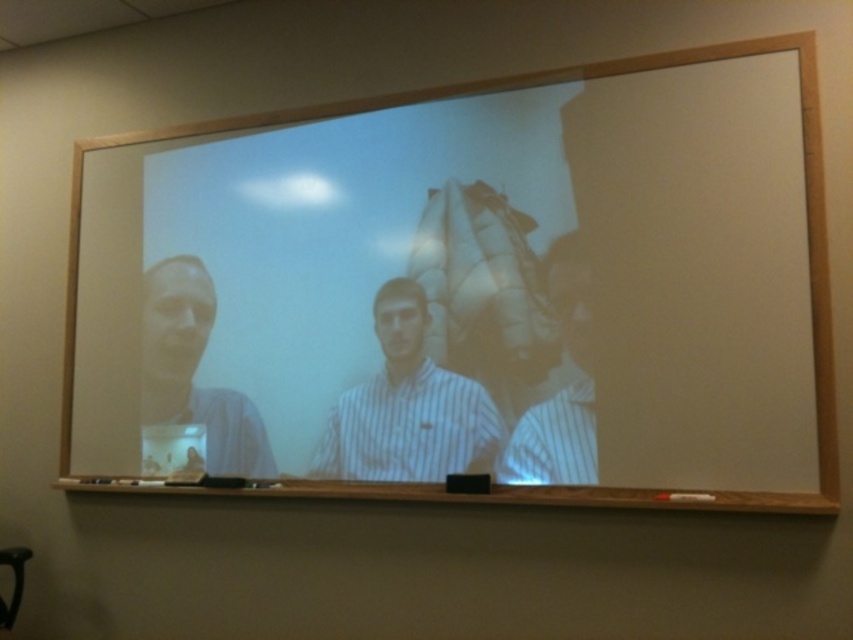
Can you confirm if wooden frame at center is positioned above matte plastic cup at left?

Indeed, wooden frame at center is positioned over matte plastic cup at left.

Based on the photo, is wooden frame at center wider than matte plastic cup at left?

Correct, the width of wooden frame at center exceeds that of matte plastic cup at left.

Where is `wooden frame at center`? This screenshot has height=640, width=853. wooden frame at center is located at coordinates (471, 289).

The image size is (853, 640). Find the location of `wooden frame at center`. wooden frame at center is located at coordinates (471, 289).

Is wooden frame at center in front of white striped shirt at center?

Yes, it is in front of white striped shirt at center.

Can you confirm if wooden frame at center is smaller than white striped shirt at center?

No.

Which is in front, point (780, 168) or point (469, 385)?

Positioned in front is point (780, 168).

Locate an element on the screen. This screenshot has width=853, height=640. wooden frame at center is located at coordinates (471, 289).

What do you see at coordinates (408, 406) in the screenshot? Image resolution: width=853 pixels, height=640 pixels. I see `white striped shirt at center` at bounding box center [408, 406].

Does white striped shirt at center appear over matte plastic cup at left?

No, white striped shirt at center is not above matte plastic cup at left.

Is point (438, 372) behind point (173, 400)?

No.

The image size is (853, 640). I want to click on white striped shirt at center, so click(x=408, y=406).